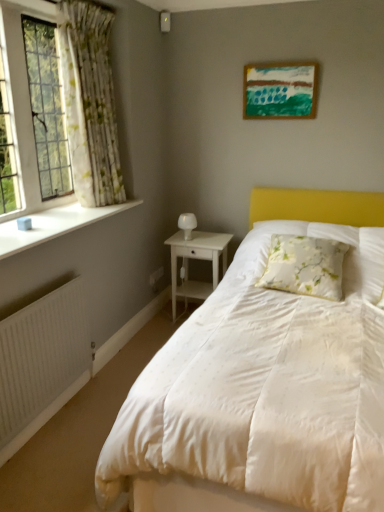
Question: Is white smooth window sill at left aimed at white glossy table lamp at center?

Choices:
 (A) yes
 (B) no

Answer: (B)

Question: Is white smooth window sill at left at the left side of white glossy table lamp at center?

Choices:
 (A) no
 (B) yes

Answer: (B)

Question: Can you confirm if white smooth window sill at left is wider than white glossy table lamp at center?

Choices:
 (A) yes
 (B) no

Answer: (A)

Question: Is white smooth window sill at left closer to the viewer compared to white glossy table lamp at center?

Choices:
 (A) no
 (B) yes

Answer: (B)

Question: Does white smooth window sill at left have a larger size compared to white glossy table lamp at center?

Choices:
 (A) no
 (B) yes

Answer: (B)

Question: Is white smooth window sill at left shorter than white glossy table lamp at center?

Choices:
 (A) no
 (B) yes

Answer: (B)

Question: Considering the relative sizes of floral fabric pillow at center and white smooth window sill at left in the image provided, is floral fabric pillow at center taller than white smooth window sill at left?

Choices:
 (A) yes
 (B) no

Answer: (A)

Question: Does floral fabric pillow at center lie in front of white smooth window sill at left?

Choices:
 (A) yes
 (B) no

Answer: (B)

Question: Considering the relative sizes of floral fabric pillow at center and white smooth window sill at left in the image provided, is floral fabric pillow at center bigger than white smooth window sill at left?

Choices:
 (A) yes
 (B) no

Answer: (A)

Question: Does floral fabric pillow at center turn towards white smooth window sill at left?

Choices:
 (A) no
 (B) yes

Answer: (A)

Question: From the image's perspective, would you say floral fabric pillow at center is shown under white smooth window sill at left?

Choices:
 (A) yes
 (B) no

Answer: (A)

Question: From the image's perspective, is floral fabric pillow at center on white smooth window sill at left?

Choices:
 (A) no
 (B) yes

Answer: (A)

Question: Does white glossy table lamp at center appear on the right side of floral fabric pillow at center?

Choices:
 (A) no
 (B) yes

Answer: (A)